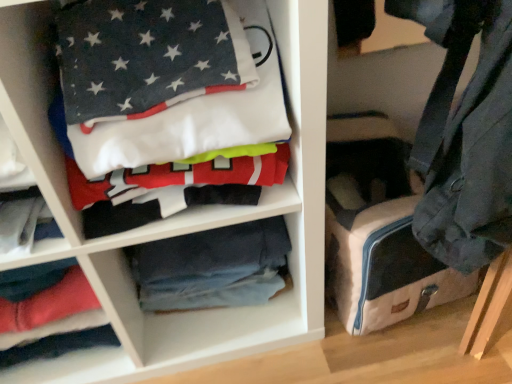
This screenshot has width=512, height=384. Find the location of `free space in front of canvas suitcase at lower right`. free space in front of canvas suitcase at lower right is located at coordinates (434, 359).